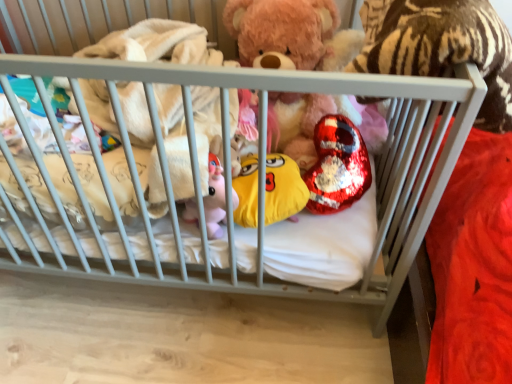
Find the location of a particular element. free space on the front side of shiny sequined heart at center, arranged as the 2th toy when viewed from the left is located at coordinates (338, 238).